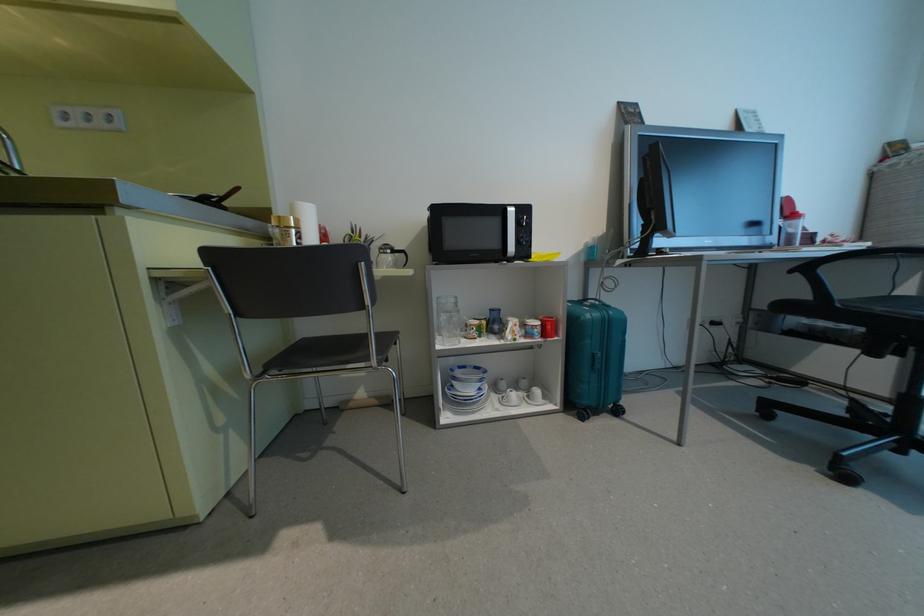
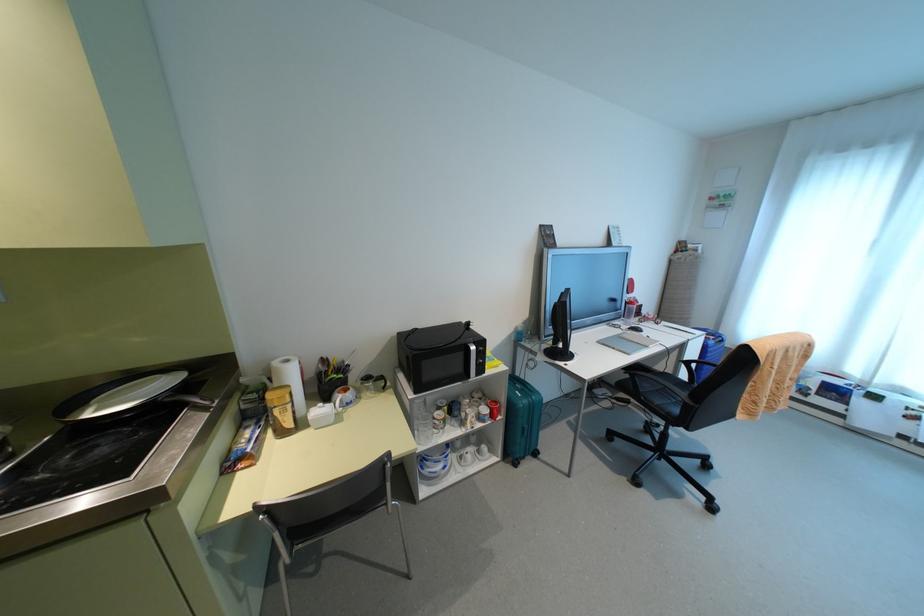
In the second image, find the point that corresponds to the point at 512,208 in the first image.

(472, 347)